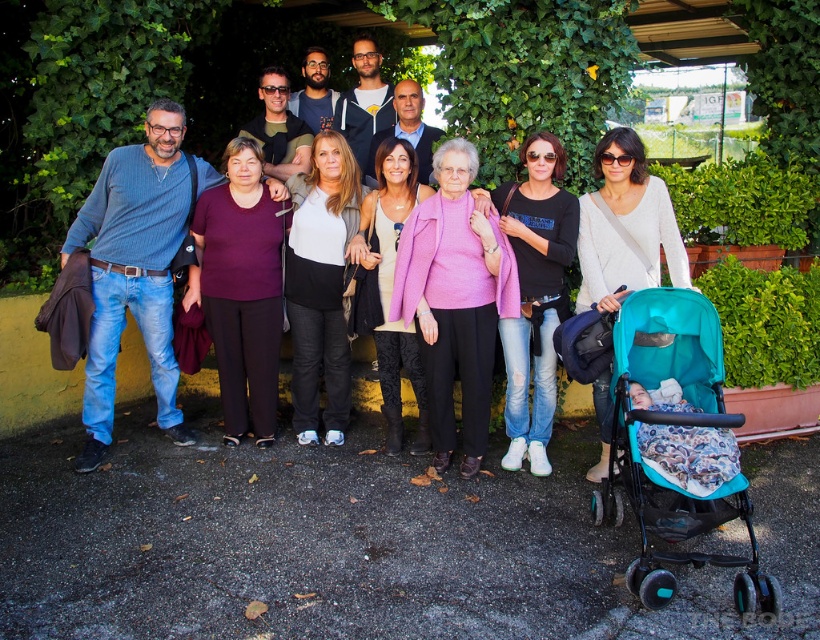
You are standing in the group of ten people under the ivy canopy. You notice two points marked in the scene at coordinates point (656, 486) and point (541, 458). Which point is closer to you?

Point (656, 486) is closer to the viewer than point (541, 458).

You are a photographer trying to capture a clear shot of both strollers in the scene. Since you want to ensure both strollers are visible in your frame, which direction should you position yourself relative to the group to include both the teal fabric stroller at lower right and the matte black stroller at lower right?

To capture both the teal fabric stroller at lower right and the matte black stroller at lower right in your frame, you should position yourself to the left of the group. This way, the teal fabric stroller at lower right, which is to the right of the matte black stroller at lower right, will be visible alongside the matte black stroller at lower right.

You are a photographer trying to capture a clear shot of the group without any strollers blocking the view. Which stroller should you move to ensure the teal fabric stroller at lower right and the matte black stroller at lower right are both visible in the frame?

The teal fabric stroller at lower right is below the matte black stroller at lower right. To ensure both are visible, move the matte black stroller at lower right upwards so it doesn not block the view of the teal fabric stroller below.